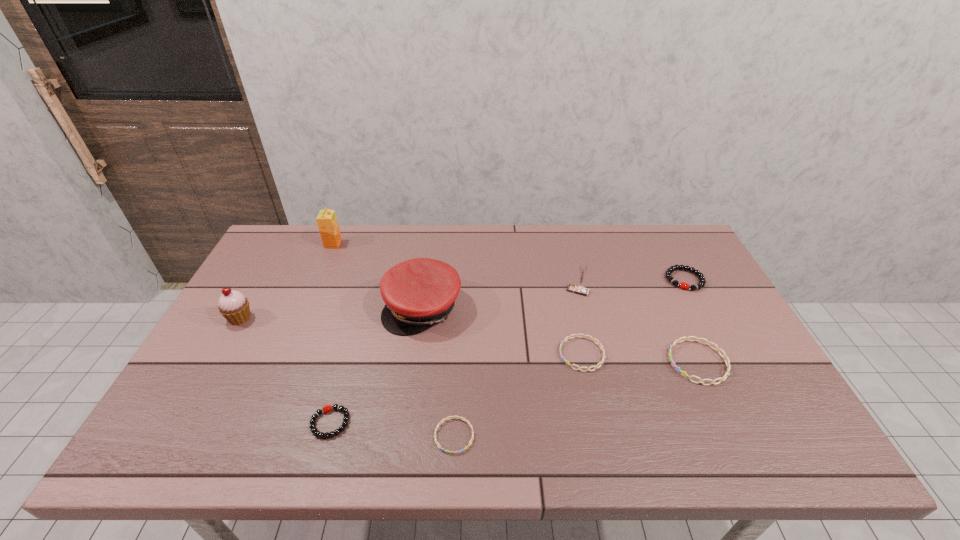
In the image, there is a desktop. Where is `vacant space at the far edge`? vacant space at the far edge is located at coordinates point(588,255).

In the image, there is a desktop. Identify the location of vacant space at the near edge. (340, 448).

The image size is (960, 540). I want to click on free space at the left edge of the desktop, so click(260, 308).

At what (x,y) coordinates should I click in order to perform the action: click on free space at the right edge of the desktop. Please return your answer as a coordinate pair (x, y). The width and height of the screenshot is (960, 540). Looking at the image, I should click on (741, 363).

The width and height of the screenshot is (960, 540). Identify the location of free region at the near left corner. (156, 450).

You are a GUI agent. You are given a task and a screenshot of the screen. Output one action in this format:
    pyautogui.click(x=<x>, y=<y>)
    Task: Click on the free spot between the smallest blue bracelet and the third bracelet from right to left
    This screenshot has width=960, height=540.
    Given the screenshot: What is the action you would take?
    pyautogui.click(x=518, y=395)

Where is `free spot between the rightmost blue bracelet and the cap`? free spot between the rightmost blue bracelet and the cap is located at coordinates (561, 335).

At what (x,y) coordinates should I click in order to perform the action: click on blank region between the seventh object from right to left and the tallest object. Please return your answer as a coordinate pair (x, y). Looking at the image, I should click on (331, 333).

The image size is (960, 540). I want to click on vacant area that lies between the bigger black bracelet and the shortest bracelet, so click(x=569, y=357).

I want to click on free space between the shortest bracelet and the biggest blue bracelet, so click(576, 399).